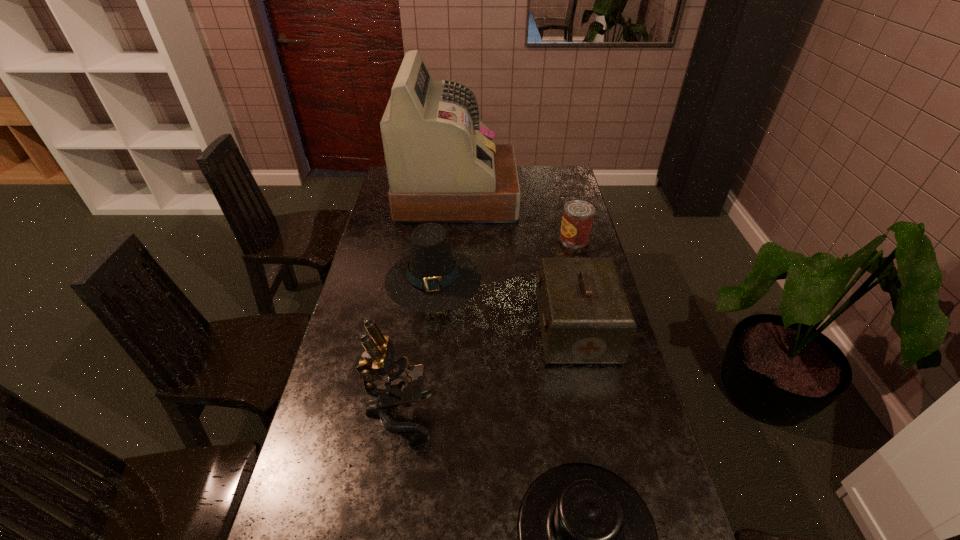
You are a GUI agent. You are given a task and a screenshot of the screen. Output one action in this format:
    pyautogui.click(x=<x>, y=<y>)
    Task: Click on the free space located at the eyepieces of the second nearest object
    
    Given the screenshot: What is the action you would take?
    pyautogui.click(x=547, y=412)

Find the location of `vacant space located 0.160m on the left of the first-aid kit`. vacant space located 0.160m on the left of the first-aid kit is located at coordinates (486, 329).

Locate an element on the screen. The width and height of the screenshot is (960, 540). free location located 0.270m on the front-facing side of the left dress hat is located at coordinates (421, 381).

Where is `free space located on the left of the second farthest object`? This screenshot has width=960, height=540. free space located on the left of the second farthest object is located at coordinates (540, 238).

Identify the location of object present at the far edge. Image resolution: width=960 pixels, height=540 pixels. (443, 167).

Find the location of a particular element. This screenshot has height=540, width=960. cash register positioned at the left edge is located at coordinates (443, 167).

Find the location of a particular element. This screenshot has height=540, width=960. microscope that is at the left edge is located at coordinates (403, 381).

I want to click on hat located at the left edge, so click(432, 278).

The width and height of the screenshot is (960, 540). What are the coordinates of `the first-aid kit present at the right edge` in the screenshot? It's located at (585, 318).

At what (x,y) coordinates should I click in order to perform the action: click on can located in the right edge section of the desktop. Please return your answer as a coordinate pair (x, y). The image size is (960, 540). Looking at the image, I should click on (578, 215).